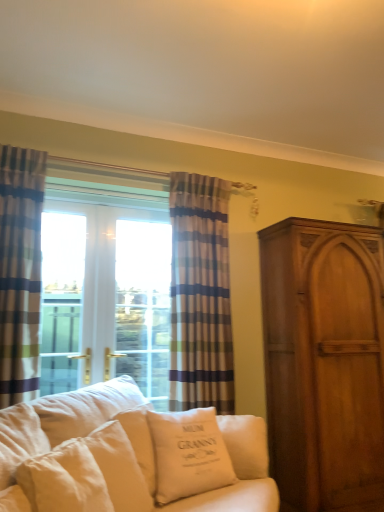
Question: From a real-world perspective, does striped fabric curtain at left, positioned as the 1th curtain in left-to-right order, stand above white cotton pillow at center, placed as the second pillow when sorted from right to left?

Choices:
 (A) yes
 (B) no

Answer: (A)

Question: Is striped fabric curtain at left, the 2th curtain viewed from the right, at the right side of white cotton pillow at center, placed as the second pillow when sorted from right to left?

Choices:
 (A) yes
 (B) no

Answer: (B)

Question: Is the depth of striped fabric curtain at left, placed as the 2th curtain when sorted from back to front, greater than that of white cotton pillow at center, placed as the second pillow when sorted from right to left?

Choices:
 (A) yes
 (B) no

Answer: (A)

Question: Is striped fabric curtain at left, positioned as the 1th curtain in left-to-right order, shorter than white cotton pillow at center, marked as the 1th pillow in a left-to-right arrangement?

Choices:
 (A) no
 (B) yes

Answer: (A)

Question: Considering the relative sizes of striped fabric curtain at left, placed as the 2th curtain when sorted from back to front, and white cotton pillow at center, marked as the 1th pillow in a left-to-right arrangement, in the image provided, is striped fabric curtain at left, placed as the 2th curtain when sorted from back to front, wider than white cotton pillow at center, marked as the 1th pillow in a left-to-right arrangement,?

Choices:
 (A) no
 (B) yes

Answer: (A)

Question: Would you say matte wood cabinet at right is to the left or to the right of white fabric couch at lower left in the picture?

Choices:
 (A) right
 (B) left

Answer: (A)

Question: Is matte wood cabinet at right wider or thinner than white fabric couch at lower left?

Choices:
 (A) wide
 (B) thin

Answer: (B)

Question: Looking at the image, does matte wood cabinet at right seem bigger or smaller compared to white fabric couch at lower left?

Choices:
 (A) small
 (B) big

Answer: (A)

Question: Is matte wood cabinet at right in front of or behind white fabric couch at lower left in the image?

Choices:
 (A) behind
 (B) front

Answer: (A)

Question: In terms of height, does matte wood cabinet at right look taller or shorter compared to white cotton pillow at center, marked as the 1th pillow in a left-to-right arrangement?

Choices:
 (A) tall
 (B) short

Answer: (A)

Question: Is matte wood cabinet at right wider or thinner than white cotton pillow at center, placed as the second pillow when sorted from right to left?

Choices:
 (A) thin
 (B) wide

Answer: (B)

Question: Do you think matte wood cabinet at right is within white cotton pillow at center, placed as the second pillow when sorted from right to left, or outside of it?

Choices:
 (A) inside
 (B) outside

Answer: (B)

Question: Is matte wood cabinet at right to the left or to the right of white cotton pillow at center, placed as the second pillow when sorted from right to left, in the image?

Choices:
 (A) left
 (B) right

Answer: (B)

Question: In terms of height, does striped fabric curtain at center, which is the second curtain from front to back, look taller or shorter compared to white fabric couch at lower left?

Choices:
 (A) short
 (B) tall

Answer: (B)

Question: Visually, is striped fabric curtain at center, which is the second curtain from front to back, positioned to the left or to the right of white fabric couch at lower left?

Choices:
 (A) right
 (B) left

Answer: (A)